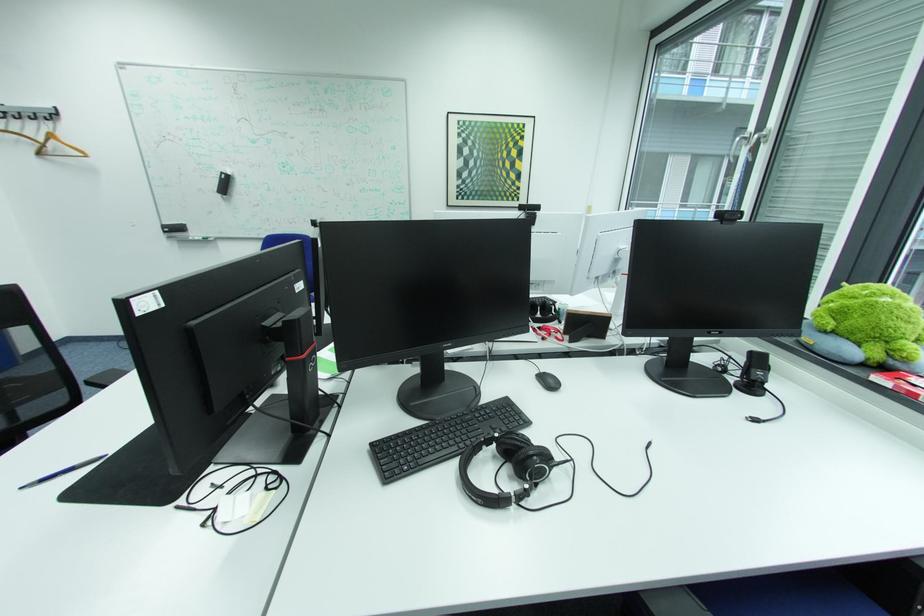
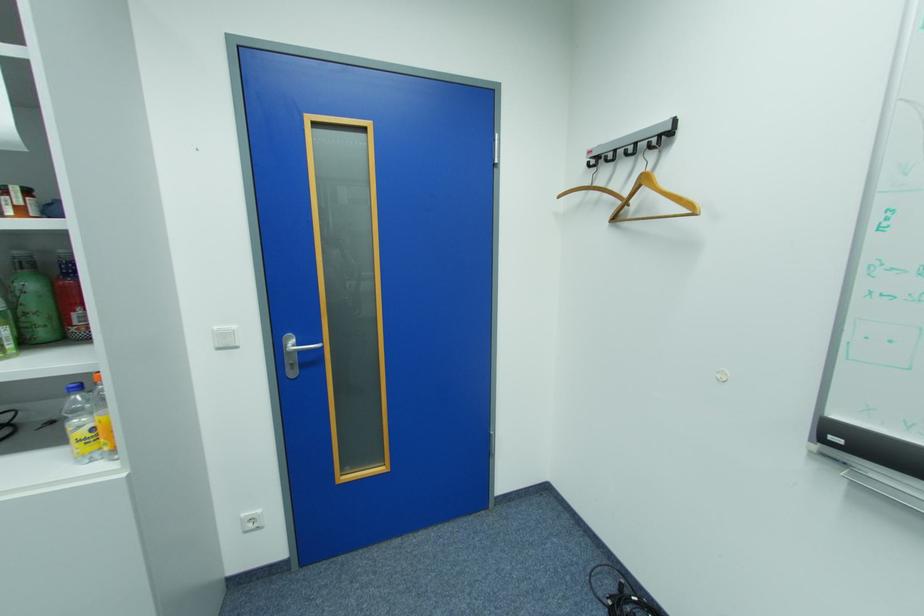
Where in the second image is the point corresponding to point 175,230 from the first image?

(845, 440)